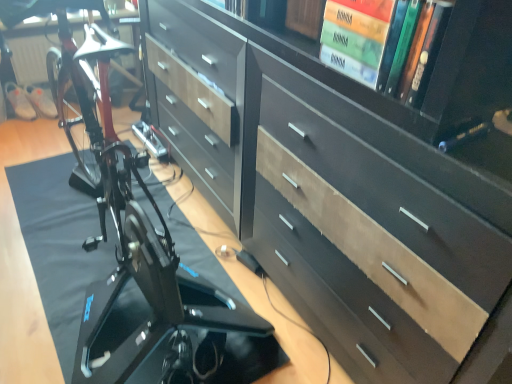
Question: Considering the positions of dark wood chest of drawers at center and black glossy bicycle at lower left in the image, is dark wood chest of drawers at center taller or shorter than black glossy bicycle at lower left?

Choices:
 (A) tall
 (B) short

Answer: (A)

Question: Is point (408, 276) positioned closer to the camera than point (174, 286)?

Choices:
 (A) closer
 (B) farther

Answer: (A)

Question: Is dark wood chest of drawers at center inside or outside of black glossy bicycle at lower left?

Choices:
 (A) outside
 (B) inside

Answer: (A)

Question: From the image's perspective, is black glossy bicycle at lower left above or below dark wood chest of drawers at center?

Choices:
 (A) below
 (B) above

Answer: (A)

Question: Based on their positions, is black glossy bicycle at lower left located to the left or right of dark wood chest of drawers at center?

Choices:
 (A) left
 (B) right

Answer: (A)

Question: From a real-world perspective, relative to dark wood chest of drawers at center, is black glossy bicycle at lower left vertically above or below?

Choices:
 (A) below
 (B) above

Answer: (A)

Question: In the image, is black glossy bicycle at lower left positioned in front of or behind dark wood chest of drawers at center?

Choices:
 (A) front
 (B) behind

Answer: (B)